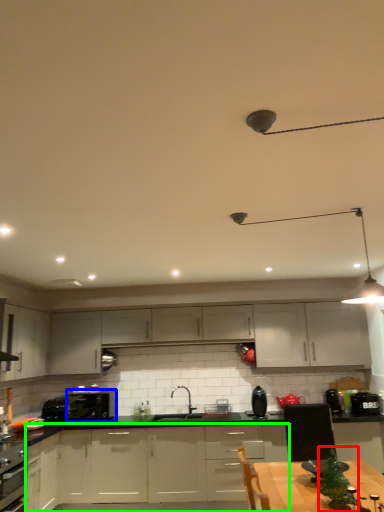
Question: Which object is the farthest from christmas tree (highlighted by a red box)? Choose among these: kitchen appliance (highlighted by a blue box) or cabinetry (highlighted by a green box).

Choices:
 (A) kitchen appliance
 (B) cabinetry

Answer: (A)